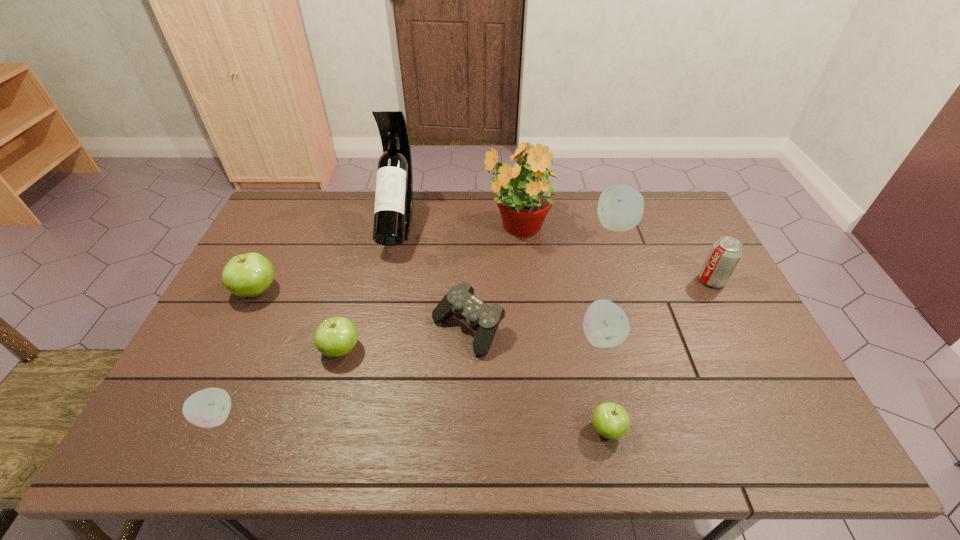
Find the location of a particular element. This screenshot has height=540, width=960. the second biggest green apple is located at coordinates (334, 337).

Locate an element on the screen. This screenshot has width=960, height=540. the fourth apple from right to left is located at coordinates (334, 337).

Identify the location of control. Image resolution: width=960 pixels, height=540 pixels. (460, 301).

At what (x,y) coordinates should I click in order to perform the action: click on the nearest white apple. Please return your answer as a coordinate pair (x, y). The height and width of the screenshot is (540, 960). Looking at the image, I should click on (208, 408).

Find the location of a particular element. Image resolution: width=960 pixels, height=540 pixels. the leftmost white apple is located at coordinates (208, 408).

Where is `the nearest green apple`? the nearest green apple is located at coordinates (611, 420).

Locate an element on the screen. This screenshot has width=960, height=540. the smallest green apple is located at coordinates (611, 420).

Where is `vacant space situated 0.150m on the stand of the black wine bottle`? The height and width of the screenshot is (540, 960). vacant space situated 0.150m on the stand of the black wine bottle is located at coordinates (383, 296).

The image size is (960, 540). I want to click on vacant space located on the back of the flowerpot, so click(x=513, y=194).

Where is `vacant region located on the left of the farthest apple`? This screenshot has height=540, width=960. vacant region located on the left of the farthest apple is located at coordinates (549, 226).